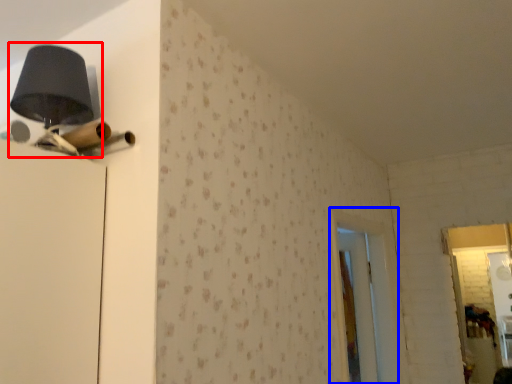
Question: Which of the following is the farthest to the observer, table lamp (highlighted by a red box) or screen door (highlighted by a blue box)?

Choices:
 (A) table lamp
 (B) screen door

Answer: (B)